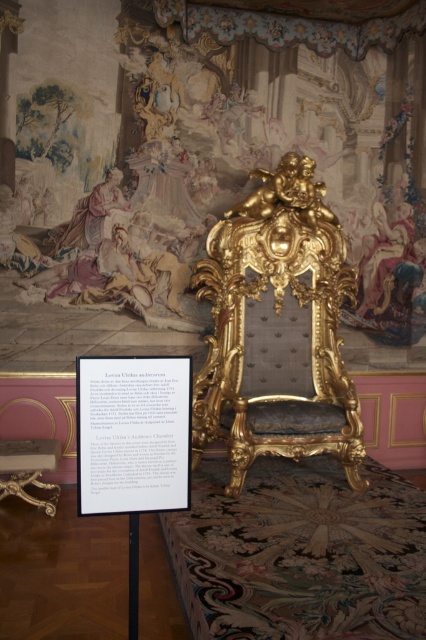
You are an interior designer planning to place a new rug in the center of the room. Given the gold upholstered armchair at center is positioned at coordinates approximately 0.541 on the x and 0.648 on the y axis, will the chair be directly over the rug if the rug is centered at the room midpoint?

The gold upholstered armchair at center is located at point (276, 346), so if the rug is centered at the room midpoint, the chair will not be exactly over the rug unless the midpoint coordinates match those of the chair.

You are an interior designer observing the opulent interior space. You need to place a decorative item on the surface closest to you between the white paper at center and the gold polished wood table at lower left. Which object should you choose?

The white paper at center is closer to the viewer than the gold polished wood table at lower left, so you should place the decorative item on the white paper at center.